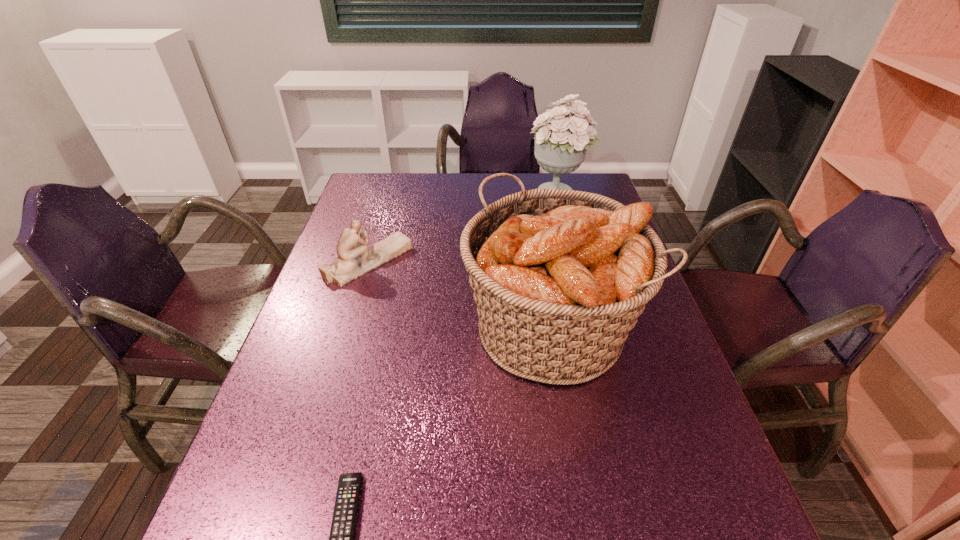
Where is `object that is positioned at the far right corner`? object that is positioned at the far right corner is located at coordinates (560, 147).

In the image, there is a desktop. Where is `vacant space at the far edge`? vacant space at the far edge is located at coordinates (502, 192).

Identify the location of vacant space at the near edge of the desktop. (400, 537).

Find the location of a particular element. This screenshot has height=540, width=960. free space at the left edge is located at coordinates (349, 343).

Image resolution: width=960 pixels, height=540 pixels. Find the location of `vacant space at the far left corner of the desktop`. vacant space at the far left corner of the desktop is located at coordinates (395, 188).

I want to click on free space between the second shortest object and the bouquet, so click(x=464, y=227).

You are a GUI agent. You are given a task and a screenshot of the screen. Output one action in this format:
    pyautogui.click(x=<x>, y=<y>)
    Task: Click on the vacant space in between the basket and the third tallest object
    The width and height of the screenshot is (960, 540).
    Given the screenshot: What is the action you would take?
    pyautogui.click(x=460, y=295)

I want to click on empty location between the farthest object and the figurine, so click(464, 227).

You are a GUI agent. You are given a task and a screenshot of the screen. Output one action in this format:
    pyautogui.click(x=<x>, y=<y>)
    Task: Click on the vacant region between the third tallest object and the bouquet
    The width and height of the screenshot is (960, 540).
    Given the screenshot: What is the action you would take?
    pyautogui.click(x=464, y=227)

Select which object appears as the closest to the bouquet. Please provide its 2D coordinates. Your answer should be formatted as a tuple, i.e. [(x, y)], where the tuple contains the x and y coordinates of a point satisfying the conditions above.

[(559, 276)]